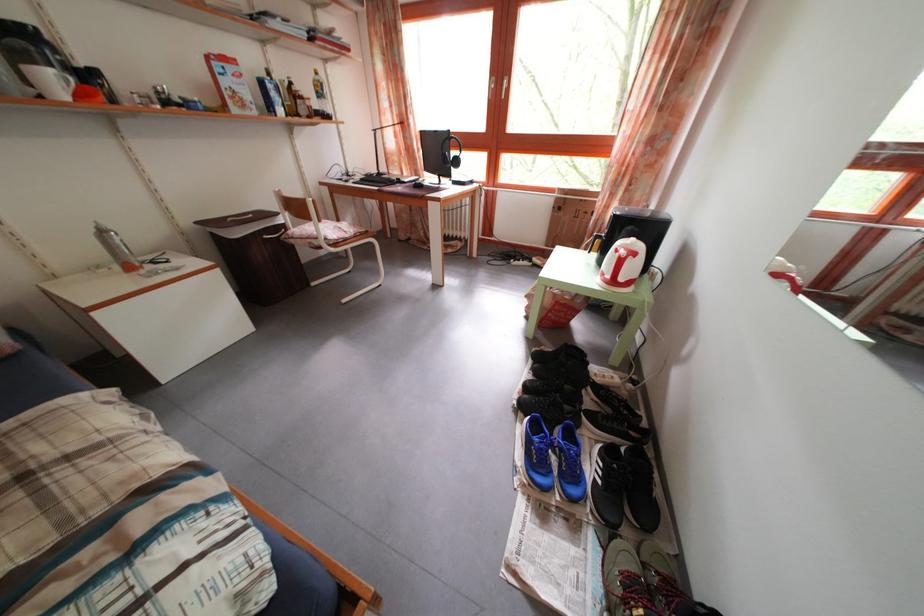
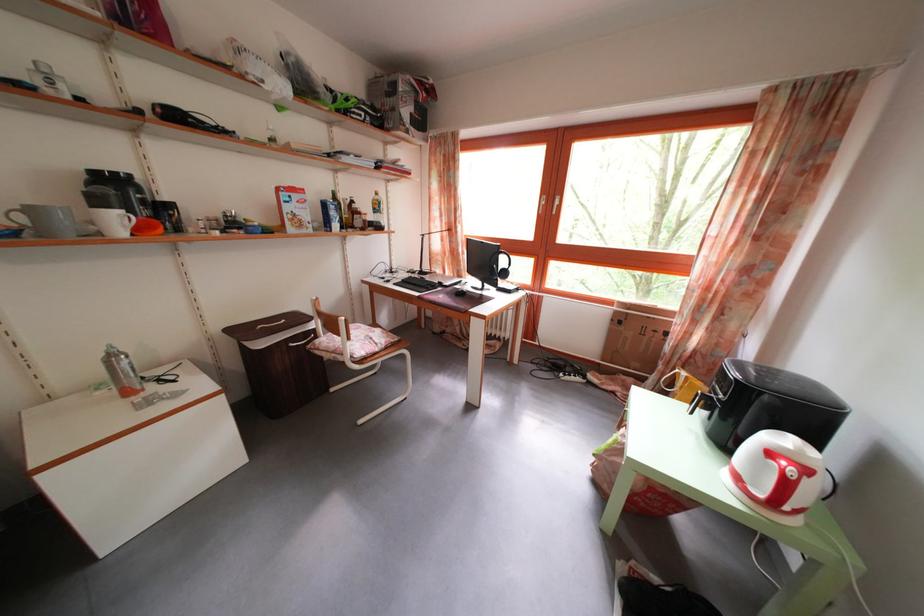
Question: The images are taken continuously from a first-person perspective. In which direction is your viewpoint rotating?

Choices:
 (A) Left
 (B) Right
 (C) Up
 (D) Down

Answer: (C)